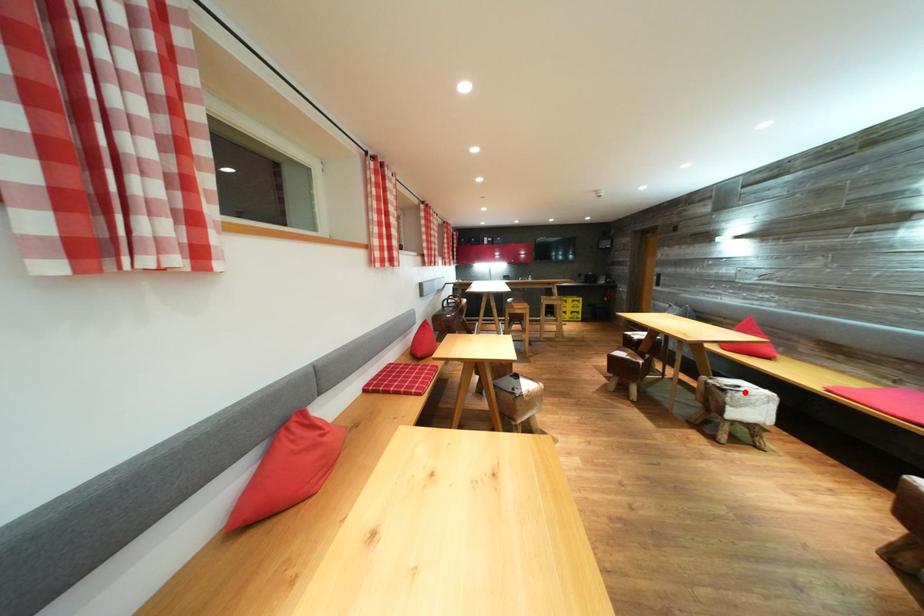
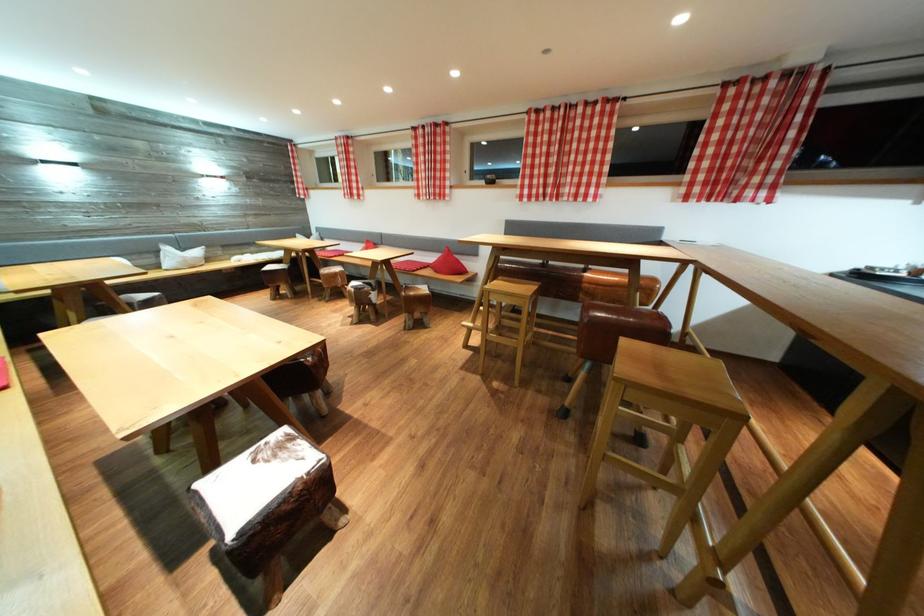
Question: I am providing you with two images of the same scene from different viewpoints. A red point is marked on the first image. At the location where the point appears in image 1, is it still visible in image 2?

Choices:
 (A) Yes
 (B) No

Answer: (B)